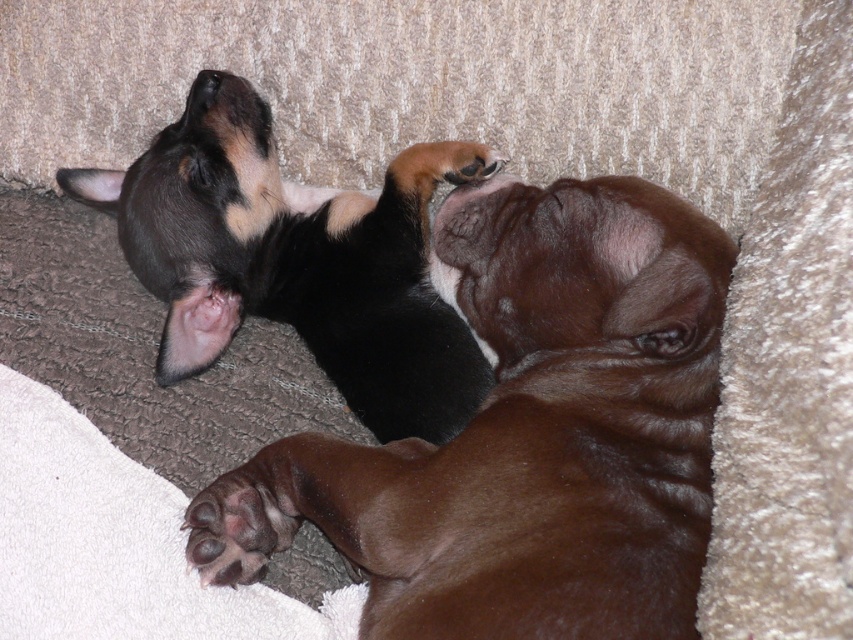
You are a dog owner who wants to place a new dog bed in the living room. You have two dogs, the brown smooth dog at center and the black matte dog at upper left. Which dog requires a larger bed based on their size?

The brown smooth dog at center requires a larger bed because it is taller than the black matte dog at upper left.

Consider the image. You are a photographer trying to capture a clear photo of the brown smooth dog at center without the black matte dog at upper left blocking it. Based on their positions, can you achieve this?

The brown smooth dog at center is in front of the black matte dog at upper left, so it is possible to take a clear photo of the brown smooth dog at center without the black matte dog at upper left blocking it by focusing on the foreground.

You are a dog owner who wants to buy a new dog bed for both your brown smooth dog at center and your black matte dog at upper left. The bed you found has a width of 1 meter. Can both dogs fit comfortably on the bed at the same time?

The brown smooth dog at center is wider than the black matte dog at upper left. Since the bed is 1 meter wide, both dogs can fit comfortably as their combined widths would likely be less than 1 meter.